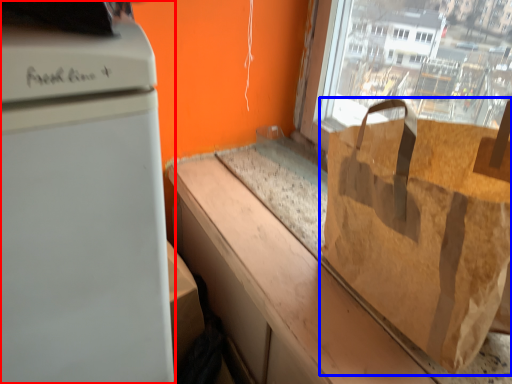
Question: Which point is further to the camera, home appliance (highlighted by a red box) or grocery bag (highlighted by a blue box)?

Choices:
 (A) home appliance
 (B) grocery bag

Answer: (B)